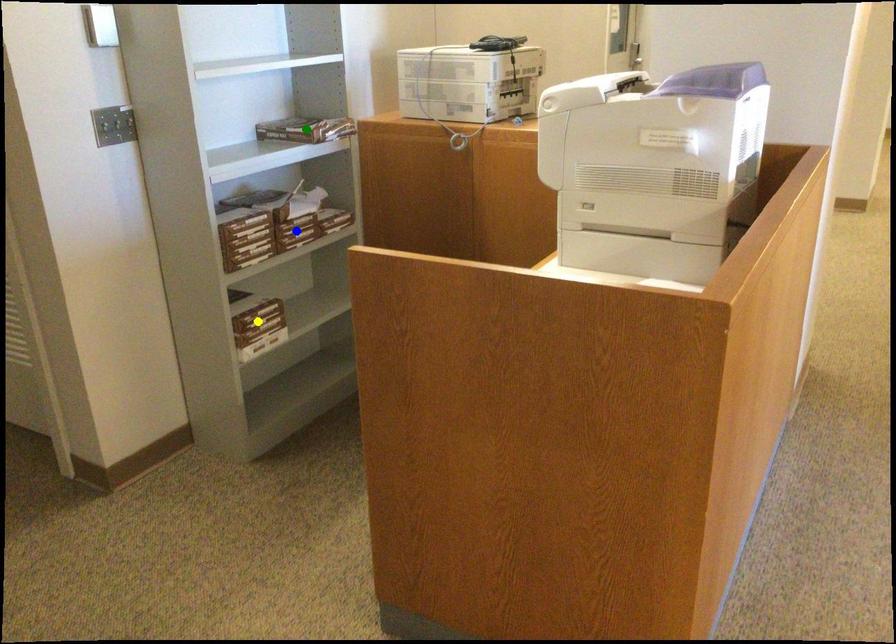
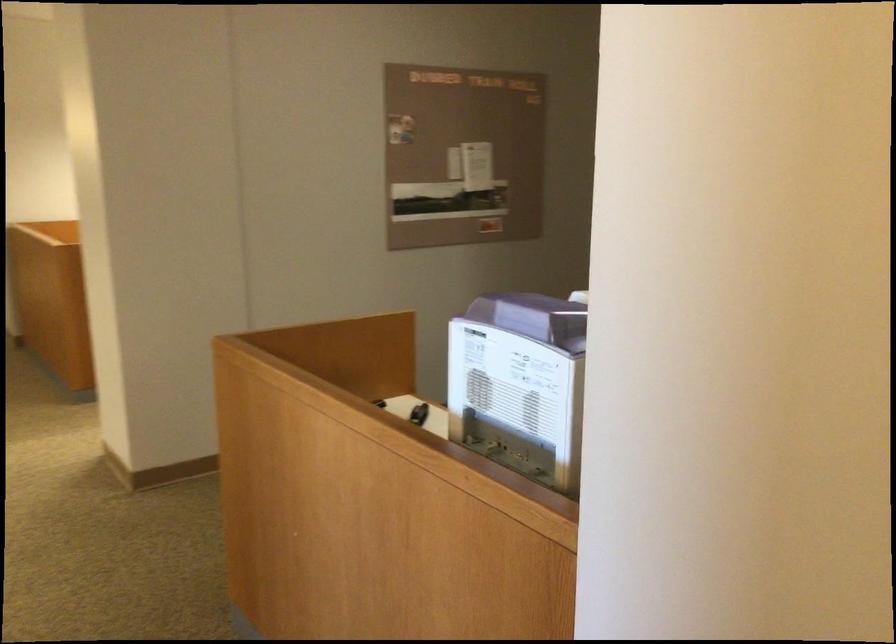
I am providing you with two images of the same scene from different viewpoints. Three points are marked in image1. Which point corresponds to a part or object that is occluded in image2?In image1, three points are marked. Which of them correspond to a part or object that is occluded in image2?Among the three points shown in image1, which one corresponds to a part or object that is no longer visible due to occlusion in image2?

blue point, yellow point, green point